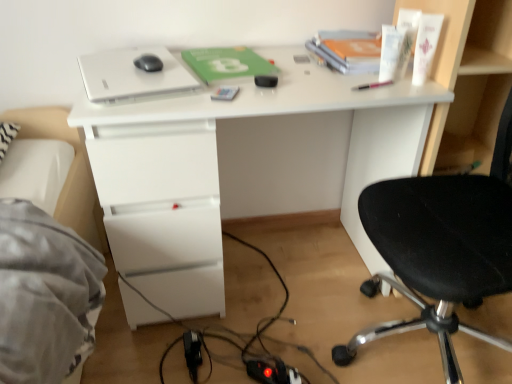
Locate an element on the screen. The height and width of the screenshot is (384, 512). vacant area on top of green matte paperback book at center (from a real-world perspective) is located at coordinates (230, 59).